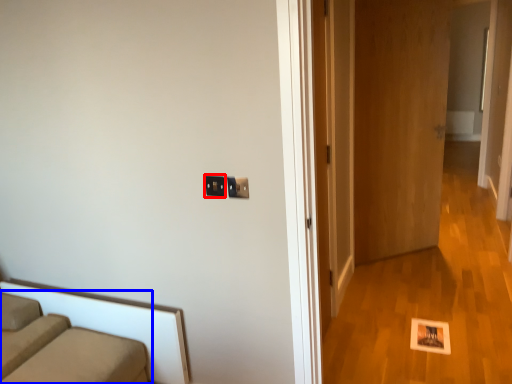
Question: Which point is closer to the camera, electric outlet (highlighted by a red box) or studio couch (highlighted by a blue box)?

Choices:
 (A) electric outlet
 (B) studio couch

Answer: (B)